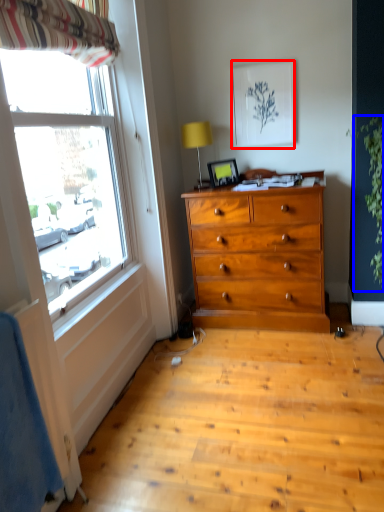
Question: Which of the following is the farthest to the observer, picture frame (highlighted by a red box) or plant (highlighted by a blue box)?

Choices:
 (A) picture frame
 (B) plant

Answer: (A)